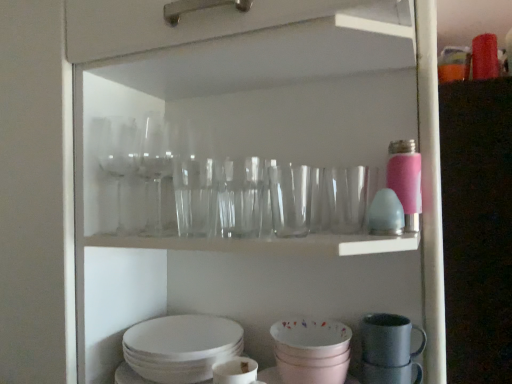
Question: From the image's perspective, is white matte mug at lower center, the 4th tableware from the right, beneath matte gray mug at lower right, marked as the 2th tableware in a right-to-left arrangement?

Choices:
 (A) yes
 (B) no

Answer: (A)

Question: Is white matte mug at lower center, the first tableware in the left-to-right sequence, behind matte gray mug at lower right, placed as the third tableware when sorted from left to right?

Choices:
 (A) no
 (B) yes

Answer: (A)

Question: Does white matte mug at lower center, the first tableware in the left-to-right sequence, have a lesser height compared to matte gray mug at lower right, placed as the third tableware when sorted from left to right?

Choices:
 (A) no
 (B) yes

Answer: (A)

Question: Is white matte mug at lower center, the first tableware in the left-to-right sequence, at the right side of matte gray mug at lower right, placed as the third tableware when sorted from left to right?

Choices:
 (A) no
 (B) yes

Answer: (A)

Question: Considering the relative positions of white matte mug at lower center, the first tableware in the left-to-right sequence, and matte gray mug at lower right, marked as the 2th tableware in a right-to-left arrangement, in the image provided, is white matte mug at lower center, the first tableware in the left-to-right sequence, to the left of matte gray mug at lower right, marked as the 2th tableware in a right-to-left arrangement, from the viewer's perspective?

Choices:
 (A) no
 (B) yes

Answer: (B)

Question: In terms of width, does matte gray mug at lower right, which is counted as the fourth tableware, starting from the left, look wider or thinner when compared to white matte mug at lower center, the 4th tableware from the right?

Choices:
 (A) thin
 (B) wide

Answer: (B)

Question: Is matte gray mug at lower right, acting as the first tableware starting from the right, inside the boundaries of white matte mug at lower center, the 4th tableware from the right, or outside?

Choices:
 (A) inside
 (B) outside

Answer: (B)

Question: Considering the positions of matte gray mug at lower right, which is counted as the fourth tableware, starting from the left, and white matte mug at lower center, the 4th tableware from the right, in the image, is matte gray mug at lower right, which is counted as the fourth tableware, starting from the left, bigger or smaller than white matte mug at lower center, the 4th tableware from the right,?

Choices:
 (A) small
 (B) big

Answer: (B)

Question: Is point (415, 379) closer or farther from the camera than point (224, 382)?

Choices:
 (A) farther
 (B) closer

Answer: (A)

Question: Is white matte mug at lower center, the 4th tableware from the right, inside the boundaries of matte gray mug at lower right, acting as the first tableware starting from the right, or outside?

Choices:
 (A) outside
 (B) inside

Answer: (A)

Question: From the image's perspective, is white matte mug at lower center, the first tableware in the left-to-right sequence, positioned above or below matte gray mug at lower right, acting as the first tableware starting from the right?

Choices:
 (A) below
 (B) above

Answer: (A)

Question: Looking at their shapes, would you say white matte mug at lower center, the first tableware in the left-to-right sequence, is wider or thinner than matte gray mug at lower right, acting as the first tableware starting from the right?

Choices:
 (A) wide
 (B) thin

Answer: (B)

Question: Is point (220, 362) closer or farther from the camera than point (376, 375)?

Choices:
 (A) closer
 (B) farther

Answer: (B)

Question: Choose the correct answer: Is white matte mug at lower center, the 4th tableware from the right, inside matte pink bowl at lower center, marked as the second tableware in a left-to-right arrangement, or outside it?

Choices:
 (A) inside
 (B) outside

Answer: (B)

Question: Considering their positions, is white matte mug at lower center, the 4th tableware from the right, located in front of or behind matte pink bowl at lower center, marked as the second tableware in a left-to-right arrangement?

Choices:
 (A) front
 (B) behind

Answer: (A)